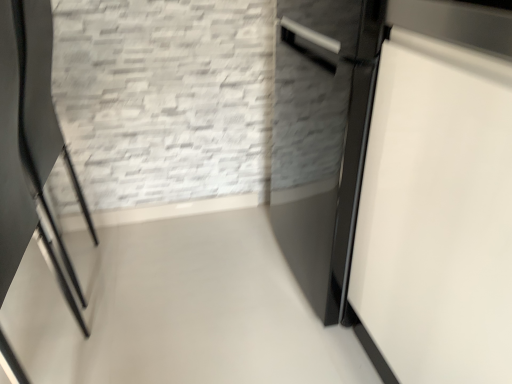
Identify the location of free spot to the right of black glossy chair at left. (151, 278).